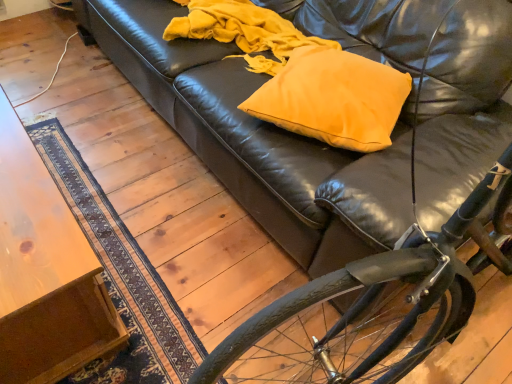
Image resolution: width=512 pixels, height=384 pixels. I want to click on unoccupied region to the right of wooden table at lower left, so click(200, 244).